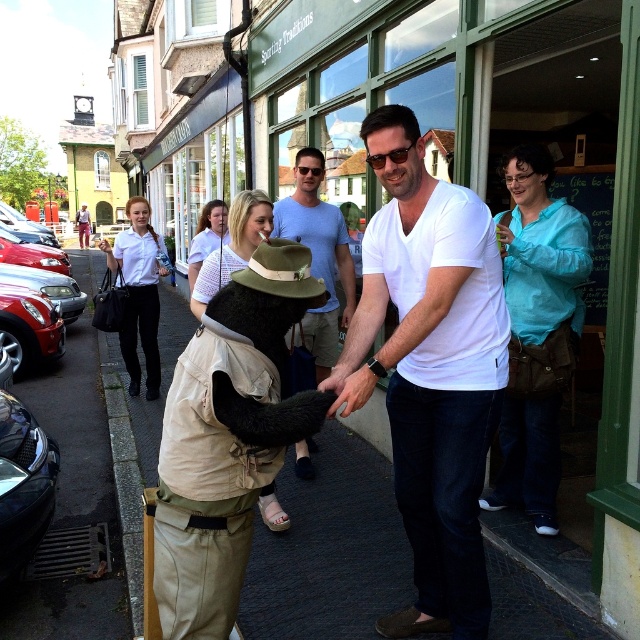
Question: Which object is closer to the camera taking this photo?

Choices:
 (A) white cotton shirt at center
 (B) green felt cowboy hat at center

Answer: (B)

Question: Does light blue cotton shirt at center have a smaller size compared to green felt cowboy hat at center?

Choices:
 (A) no
 (B) yes

Answer: (A)

Question: Among these points, which one is farthest from the camera?

Choices:
 (A) (307, 166)
 (B) (269, 292)
 (C) (260, 298)

Answer: (A)

Question: Considering the real-world distances, which object is farthest from the blue fabric shirt at upper right?

Choices:
 (A) green felt cowboy hat at center
 (B) light blue cotton shirt at center

Answer: (A)

Question: Where is white cotton shirt at center located in relation to green felt cowboy hat at center in the image?

Choices:
 (A) right
 (B) left

Answer: (A)

Question: Can you confirm if blue fabric shirt at upper right is positioned below light blue cotton shirt at center?

Choices:
 (A) no
 (B) yes

Answer: (B)